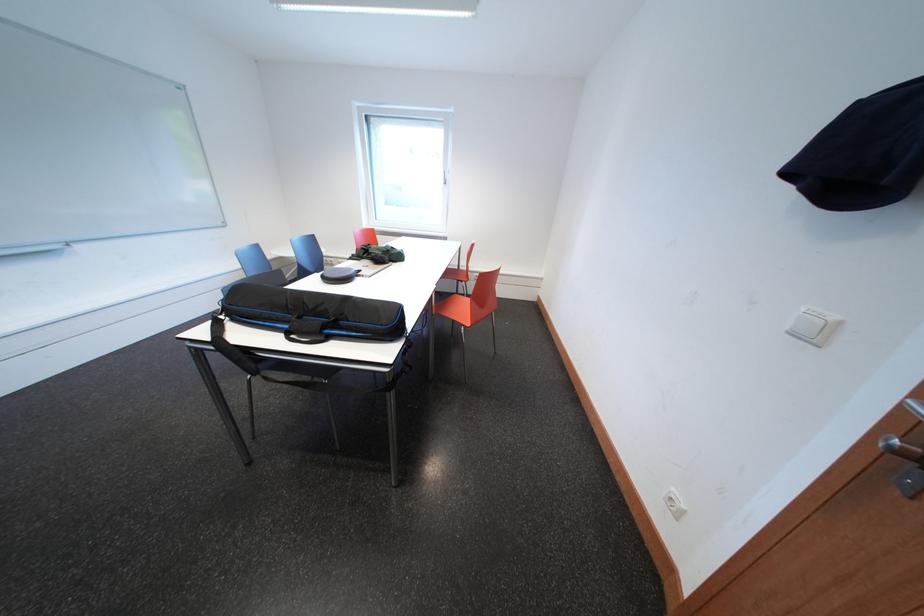
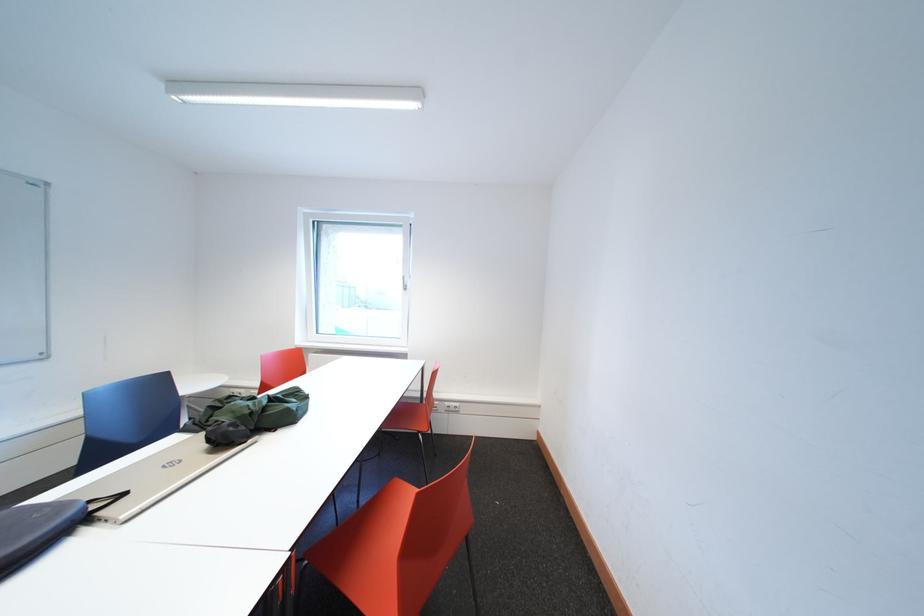
The point at [466,272] is marked in the first image. Where is the corresponding point in the second image?

(429, 400)